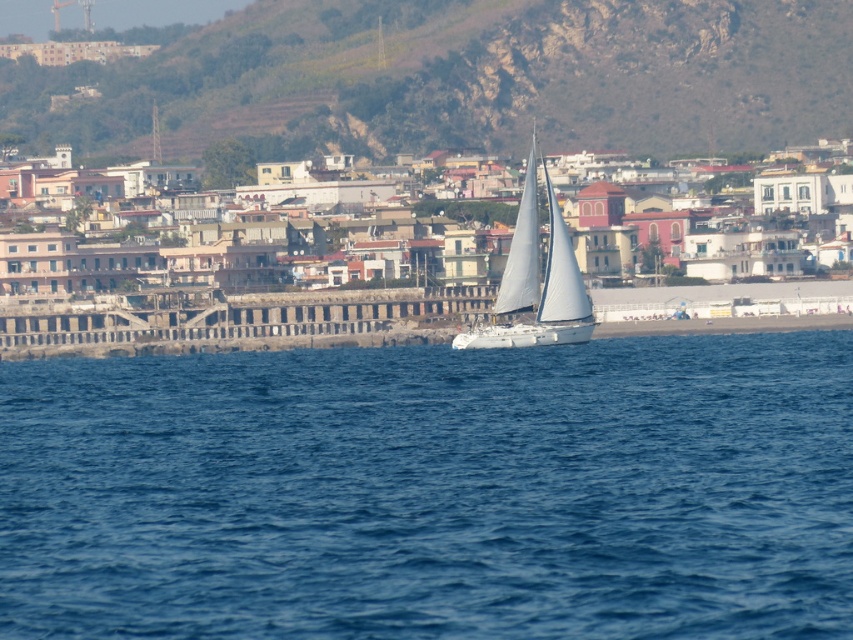
Question: Does blue water at center appear on the left side of white matte sailboat at center?

Choices:
 (A) no
 (B) yes

Answer: (B)

Question: Which object is closer to the camera taking this photo?

Choices:
 (A) blue water at center
 (B) white matte sailboat at center

Answer: (A)

Question: Considering the relative positions of green grassy hillside at upper center and white matte sailboat at center in the image provided, where is green grassy hillside at upper center located with respect to white matte sailboat at center?

Choices:
 (A) right
 (B) left

Answer: (B)

Question: Based on their relative distances, which object is farther from the white matte sailboat at center?

Choices:
 (A) blue water at center
 (B) green grassy hillside at upper center

Answer: (A)

Question: Which point is farther to the camera?

Choices:
 (A) blue water at center
 (B) white matte sailboat at center

Answer: (B)

Question: Does blue water at center come in front of white matte sailboat at center?

Choices:
 (A) no
 (B) yes

Answer: (B)